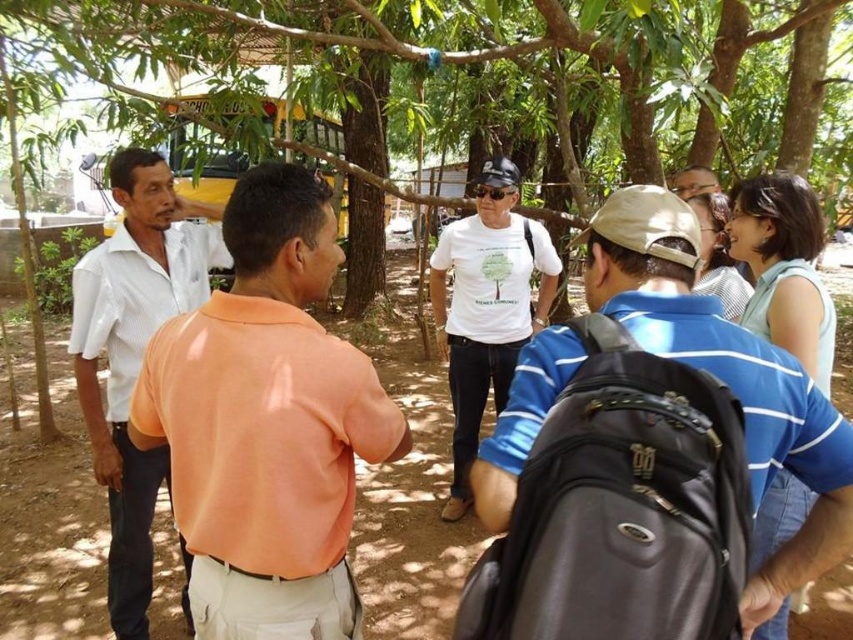
You are standing in the scene and want to move from the point at coordinates point (606, 147) to the point at coordinates point (123, 236). Which direction should you move to get closer to your destination?

You should move downward and to the right because point (123, 236) is located lower and to the right of point (606, 147).

You are standing at the center of the image and see a point marked at coordinates (726, 376). Which object does this point lie on?

The point at coordinates (726, 376) lies on the white matte t shirt at center.

You are standing at the center of the image and want to touch the brown wood tree at center. Can you reach the point located at coordinates point (392, 60) on the brown wood tree at center?

The point (392, 60) is on the brown wood tree at center, so yes, you can reach it by touching the tree at that coordinate.